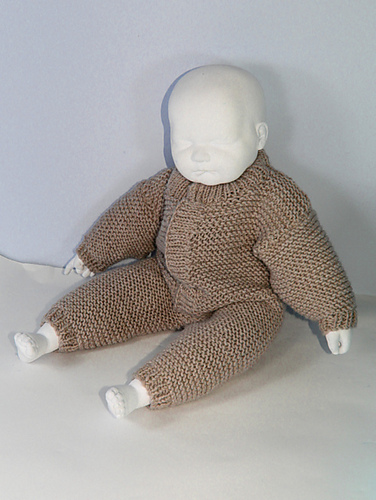
Identify the location of doll. (238, 167).